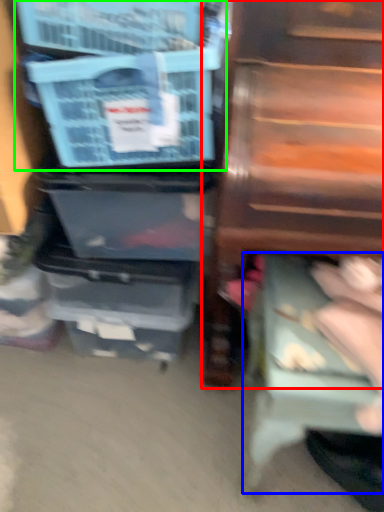
Question: Estimate the real-world distances between objects in this image. Which object is farther from furniture (highlighted by a red box), step stool (highlighted by a blue box) or storage box (highlighted by a green box)?

Choices:
 (A) step stool
 (B) storage box

Answer: (A)